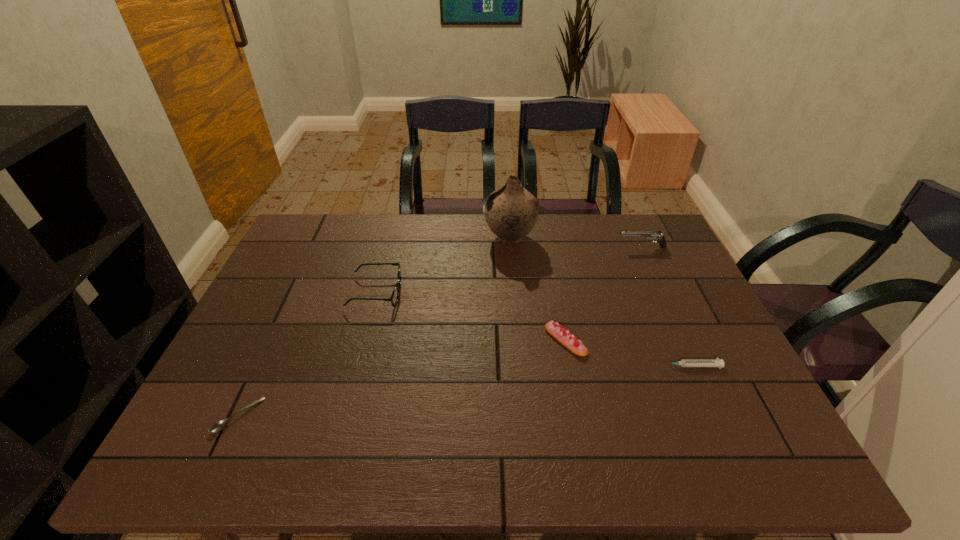
The image size is (960, 540). I want to click on vacant space situated at the needle end of the second shortest object, so click(x=628, y=366).

Locate an element on the screen. vacant space situated 0.120m on the right of the nearest object is located at coordinates (313, 416).

I want to click on pottery positioned at the far edge, so click(x=511, y=211).

The image size is (960, 540). I want to click on pistol situated at the far edge, so click(x=656, y=235).

Image resolution: width=960 pixels, height=540 pixels. In order to click on object located in the near edge section of the desktop in this screenshot , I will do `click(220, 425)`.

Where is `object at the left edge`? The image size is (960, 540). object at the left edge is located at coordinates (220, 425).

The width and height of the screenshot is (960, 540). Identify the location of pistol that is positioned at the right edge. (656, 235).

Where is `syringe that is positioned at the right edge`? Image resolution: width=960 pixels, height=540 pixels. syringe that is positioned at the right edge is located at coordinates (x=717, y=362).

At what (x,y) coordinates should I click in order to perform the action: click on object that is at the near left corner. Please return your answer as a coordinate pair (x, y). Image resolution: width=960 pixels, height=540 pixels. Looking at the image, I should click on (220, 425).

This screenshot has width=960, height=540. Find the location of `object present at the far right corner`. object present at the far right corner is located at coordinates (656, 235).